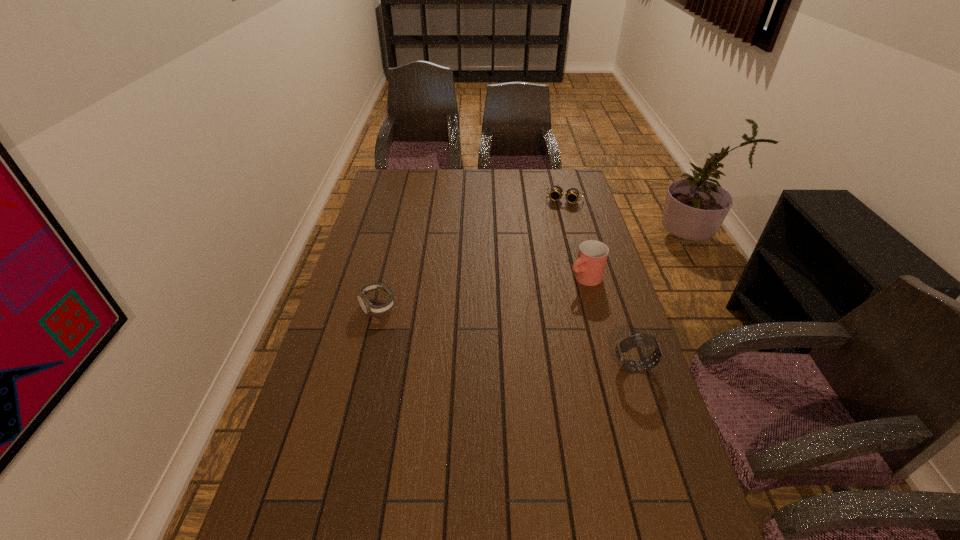
You are a GUI agent. You are given a task and a screenshot of the screen. Output one action in this format:
    pyautogui.click(x=<x>, y=<y>)
    Task: Click on the vacant region located 0.220m on the face of the taller watch
    This screenshot has width=960, height=540.
    Given the screenshot: What is the action you would take?
    pyautogui.click(x=533, y=367)

Where is `vacant region located through the lenses of the goggles`? Image resolution: width=960 pixels, height=540 pixels. vacant region located through the lenses of the goggles is located at coordinates (550, 252).

I want to click on blank space located 0.130m through the lenses of the goggles, so click(x=558, y=223).

The width and height of the screenshot is (960, 540). Find the location of `free space located through the lenses of the goggles`. free space located through the lenses of the goggles is located at coordinates pos(557,227).

Where is `vacant space located 0.400m on the side of the third nearest object with the handle`? vacant space located 0.400m on the side of the third nearest object with the handle is located at coordinates (476, 341).

Image resolution: width=960 pixels, height=540 pixels. Find the location of `vacant space located on the side of the third nearest object with the handle`. vacant space located on the side of the third nearest object with the handle is located at coordinates (494, 330).

This screenshot has height=540, width=960. In order to click on vacant space located 0.170m on the side of the third nearest object with the handle in this screenshot , I will do `click(535, 307)`.

Where is `object at the far edge`? object at the far edge is located at coordinates (556, 192).

At what (x,y) coordinates should I click in order to perform the action: click on object that is at the left edge. Please return your answer as a coordinate pair (x, y). Looking at the image, I should click on (368, 308).

At what (x,y) coordinates should I click in order to perform the action: click on watch that is at the right edge. Please return your answer as a coordinate pair (x, y). Image resolution: width=960 pixels, height=540 pixels. Looking at the image, I should click on (622, 347).